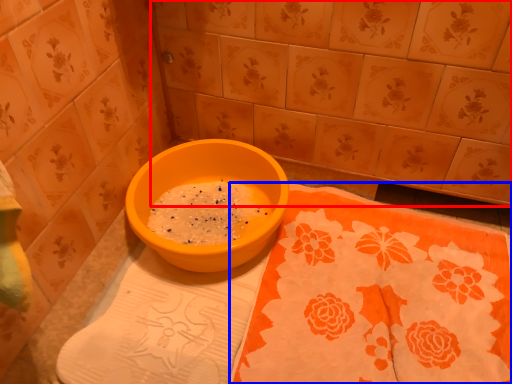
Question: Which point is further to the camera, ceramic tile (highlighted by a red box) or tablecloth (highlighted by a blue box)?

Choices:
 (A) ceramic tile
 (B) tablecloth

Answer: (A)